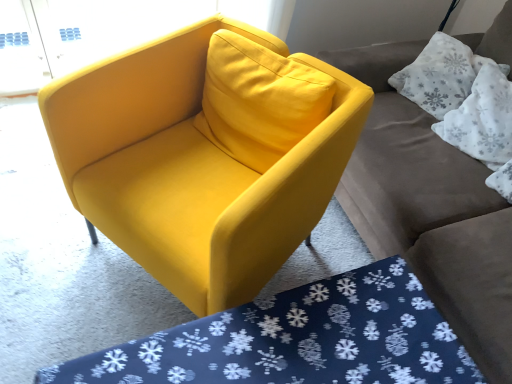
Question: Is point (490, 142) closer or farther from the camera than point (459, 205)?

Choices:
 (A) closer
 (B) farther

Answer: (B)

Question: Relative to matte gray couch at upper right, is white fabric pillow at upper right, placed as the 2th pillow when sorted from top to bottom, in front or behind?

Choices:
 (A) front
 (B) behind

Answer: (B)

Question: Considering the real-world distances, which object is closest to the matte yellow armchair at center?

Choices:
 (A) blue snowflake-patterned mat at lower center
 (B) white textured pillow at upper right, the 2th pillow positioned from the bottom
 (C) matte gray couch at upper right
 (D) white fabric pillow at upper right, the first pillow in the bottom-to-top sequence

Answer: (A)

Question: Which is farther from the white fabric pillow at upper right, placed as the 2th pillow when sorted from top to bottom?

Choices:
 (A) white textured pillow at upper right, the 2th pillow positioned from the bottom
 (B) matte gray couch at upper right
 (C) matte yellow armchair at center
 (D) blue snowflake-patterned mat at lower center

Answer: (D)